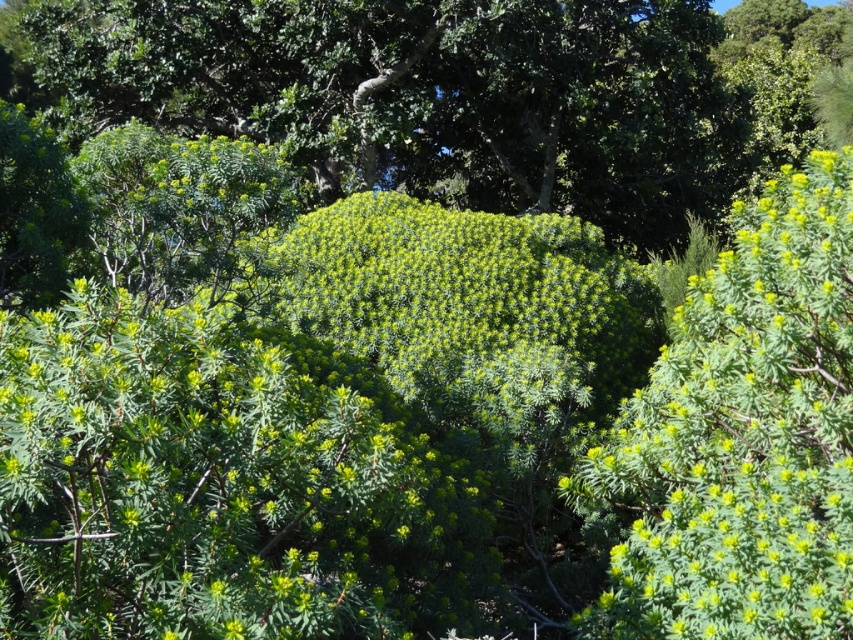
Question: Which object appears farthest from the camera in this image?

Choices:
 (A) green fuzzy bush at upper right
 (B) green leafy bush at center

Answer: (B)

Question: Is green leafy bush at center wider than green fuzzy bush at upper right?

Choices:
 (A) no
 (B) yes

Answer: (B)

Question: Can you confirm if green leafy bush at center is smaller than green fuzzy bush at upper right?

Choices:
 (A) no
 (B) yes

Answer: (A)

Question: Is green leafy bush at center thinner than green fuzzy bush at upper right?

Choices:
 (A) no
 (B) yes

Answer: (A)

Question: Which point appears farthest from the camera in this image?

Choices:
 (A) (592, 125)
 (B) (645, 396)

Answer: (A)

Question: Which of the following is the closest to the observer?

Choices:
 (A) (782, 608)
 (B) (317, 116)

Answer: (A)